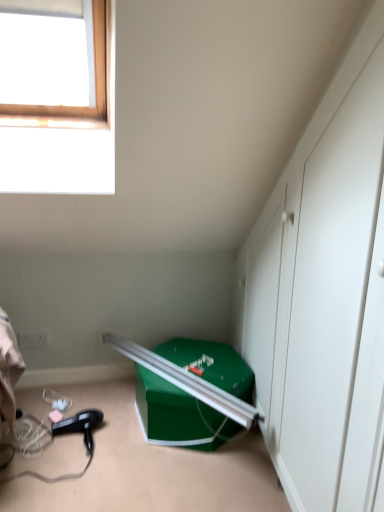
Question: From a real-world perspective, is black plastic hair dryer at lower left positioned under green cardboard box at lower right based on gravity?

Choices:
 (A) no
 (B) yes

Answer: (B)

Question: Is black plastic hair dryer at lower left positioned behind green cardboard box at lower right?

Choices:
 (A) no
 (B) yes

Answer: (B)

Question: Are black plastic hair dryer at lower left and green cardboard box at lower right beside each other?

Choices:
 (A) yes
 (B) no

Answer: (B)

Question: Can you confirm if black plastic hair dryer at lower left is shorter than green cardboard box at lower right?

Choices:
 (A) yes
 (B) no

Answer: (A)

Question: Is black plastic hair dryer at lower left located outside green cardboard box at lower right?

Choices:
 (A) yes
 (B) no

Answer: (A)

Question: Does black plastic hair dryer at lower left have a smaller size compared to green cardboard box at lower right?

Choices:
 (A) yes
 (B) no

Answer: (A)

Question: Can you confirm if green cardboard box at lower right is positioned to the right of black plastic hair dryer at lower left?

Choices:
 (A) yes
 (B) no

Answer: (A)

Question: From a real-world perspective, is green cardboard box at lower right beneath black plastic hair dryer at lower left?

Choices:
 (A) yes
 (B) no

Answer: (B)

Question: Does green cardboard box at lower right have a smaller size compared to black plastic hair dryer at lower left?

Choices:
 (A) yes
 (B) no

Answer: (B)

Question: Would you say green cardboard box at lower right is outside black plastic hair dryer at lower left?

Choices:
 (A) no
 (B) yes

Answer: (B)

Question: Does green cardboard box at lower right contain black plastic hair dryer at lower left?

Choices:
 (A) yes
 (B) no

Answer: (B)

Question: Is green cardboard box at lower right positioned with its back to black plastic hair dryer at lower left?

Choices:
 (A) no
 (B) yes

Answer: (A)

Question: In terms of width, does black plastic hair dryer at lower left look wider or thinner when compared to green cardboard box at lower right?

Choices:
 (A) thin
 (B) wide

Answer: (A)